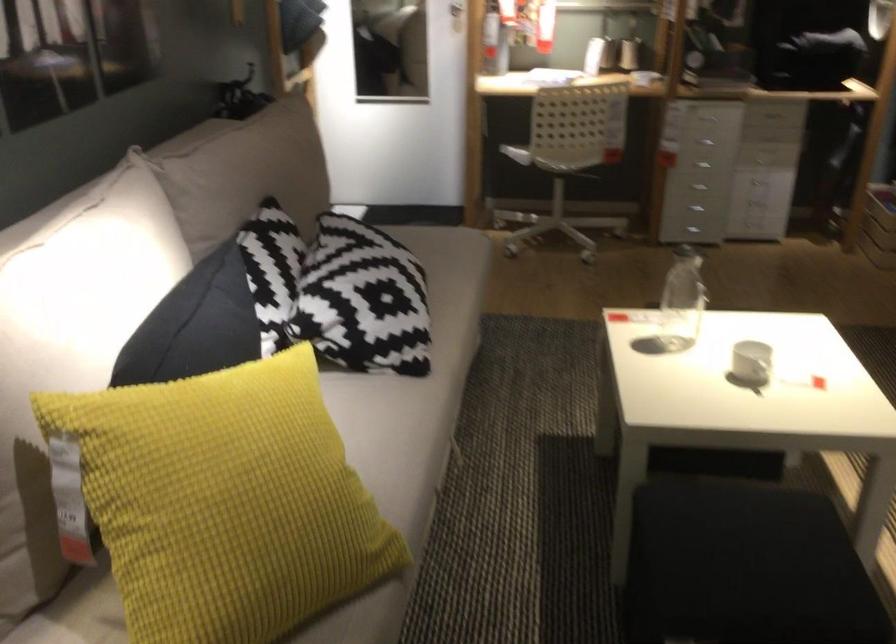
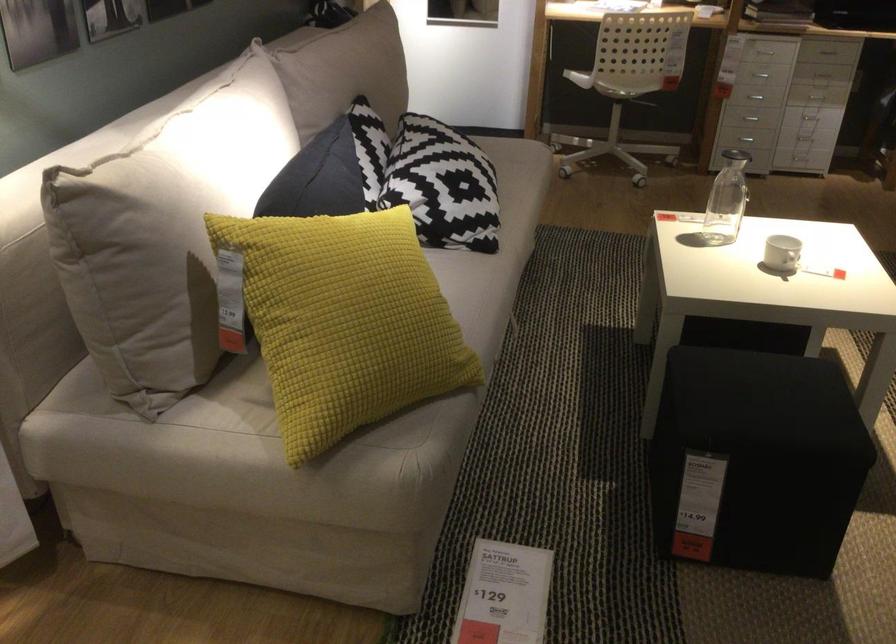
Find the pixel in the second image that matches [194,325] in the first image.

(317, 178)